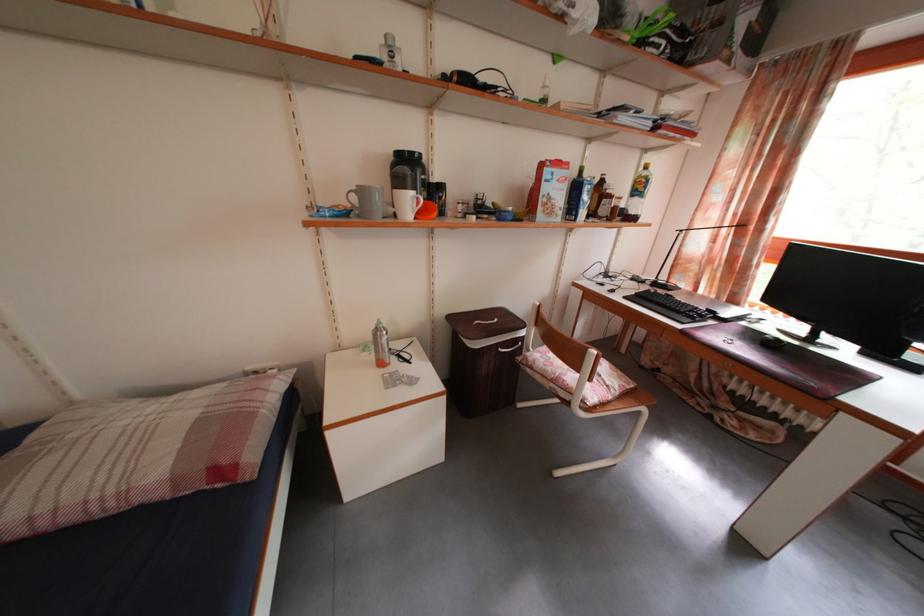
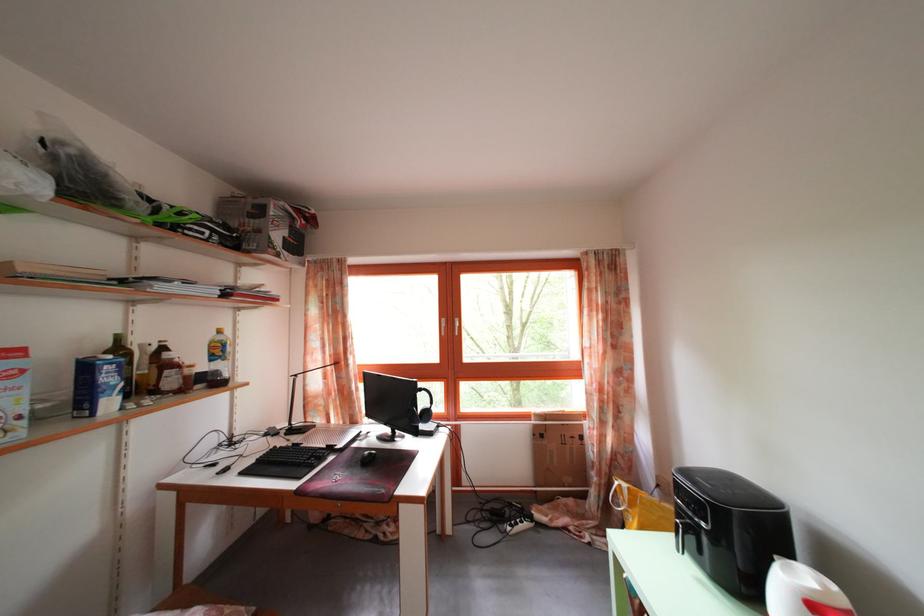
Question: I am providing you with two images of the same scene from different viewpoints. Please identify which objects are invisible in image2.

Choices:
 (A) brown cardboard box
 (B) black headphones
 (C) small framed picture
 (D) black computer mouse

Answer: (D)